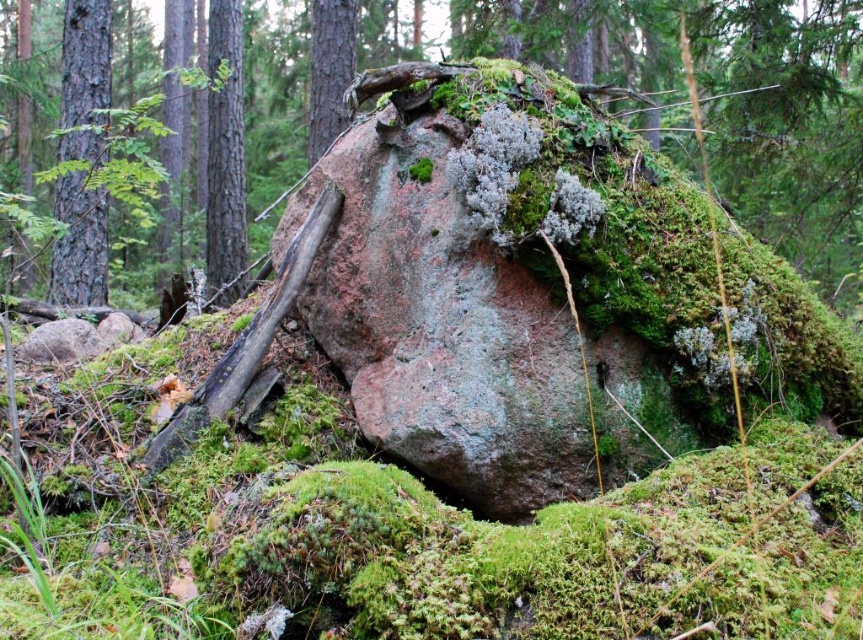
Question: Is green mossy rock at center below brown wood tree at center?

Choices:
 (A) yes
 (B) no

Answer: (B)

Question: Does smooth brown tree trunk at left have a lesser width compared to green mossy tree trunk at upper center?

Choices:
 (A) no
 (B) yes

Answer: (A)

Question: Does green mossy rock at center have a lesser width compared to brown wood tree at center?

Choices:
 (A) no
 (B) yes

Answer: (A)

Question: Based on their relative distances, which object is nearer to the green mossy tree trunk at upper center?

Choices:
 (A) brown wood tree at center
 (B) smooth brown tree trunk at left
 (C) green mossy rock at center

Answer: (B)

Question: Which point appears farthest from the camera in this image?

Choices:
 (A) (106, 193)
 (B) (756, 140)
 (C) (339, 115)
 (D) (235, 196)

Answer: (D)

Question: Estimate the real-world distances between objects in this image. Which object is farther from the brown wood tree at center?

Choices:
 (A) smooth brown tree trunk at left
 (B) green mossy tree trunk at upper center

Answer: (A)